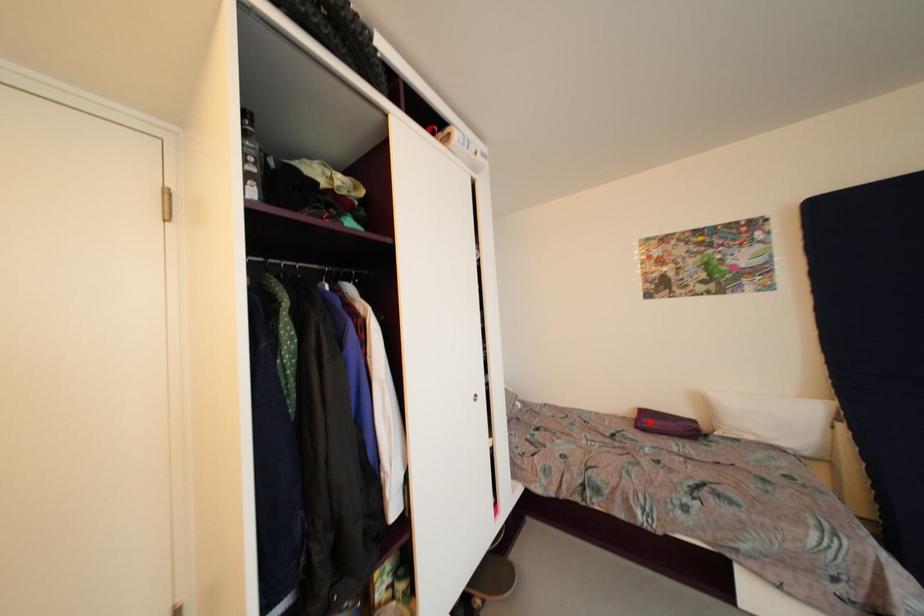
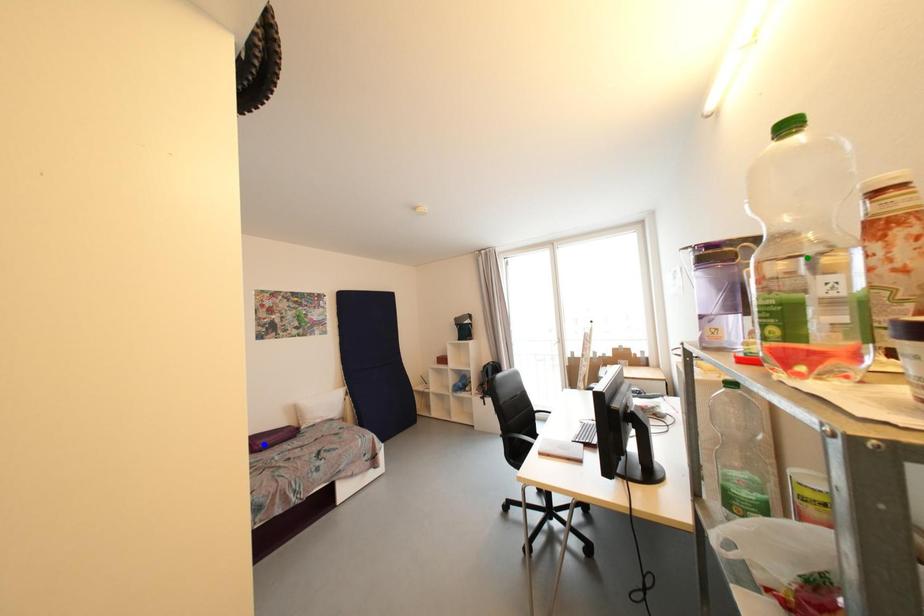
Question: I am providing you with two images of the same scene from different viewpoints. A red point is marked on the first image. You are given multiple points on the second image. Which spot in image 2 lines up with the point in image 1?

Choices:
 (A) yellow point
 (B) green point
 (C) blue point

Answer: (C)